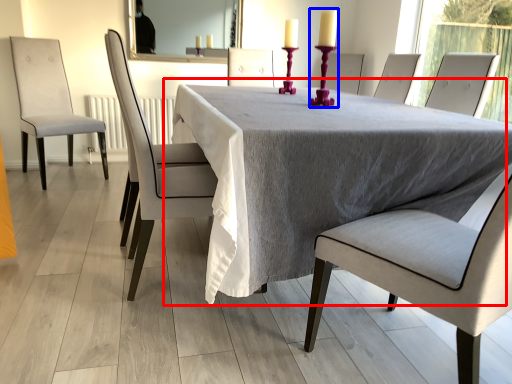
Question: Among these objects, which one is farthest to the camera, table (highlighted by a red box) or candle holder (highlighted by a blue box)?

Choices:
 (A) table
 (B) candle holder

Answer: (B)